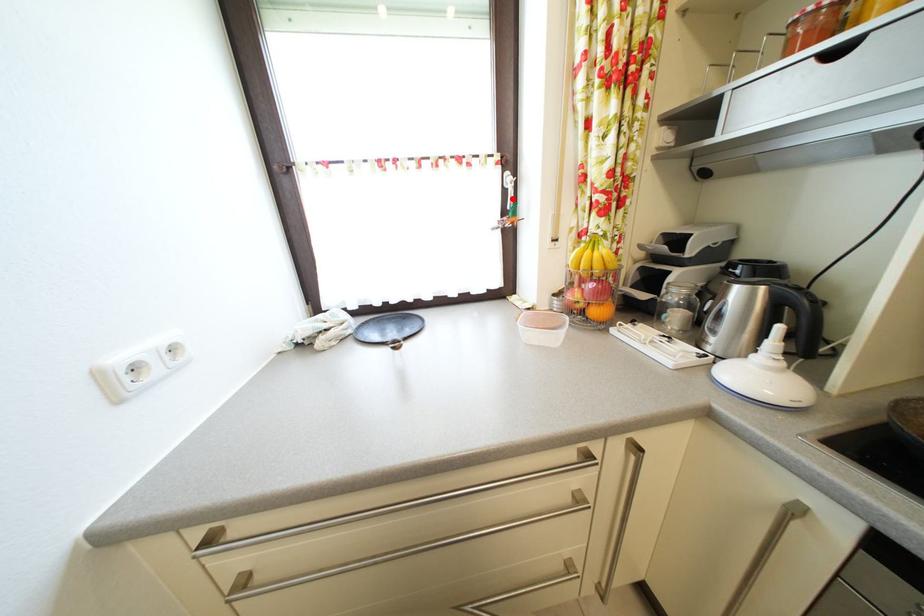
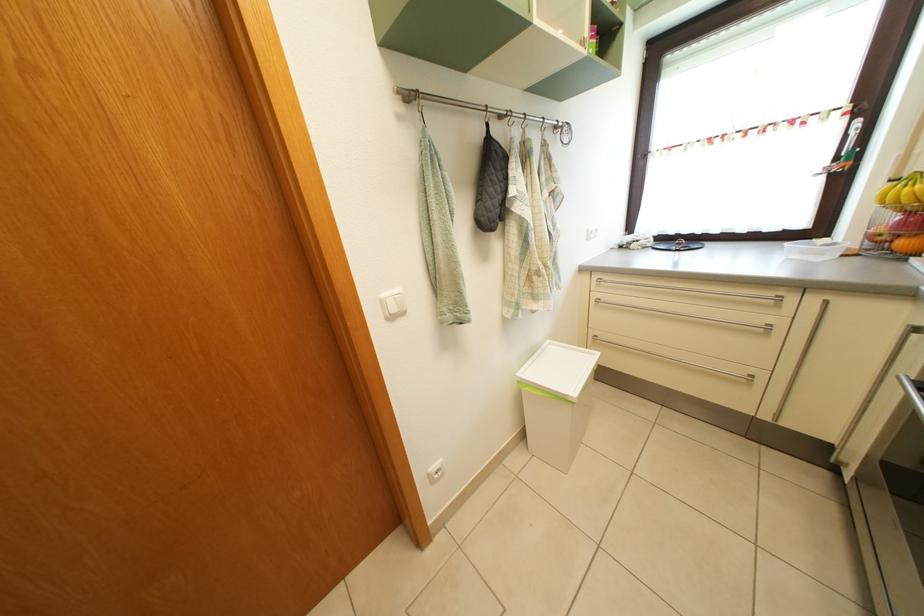
Where in the second image is the point corresponding to the highlighted location from the first image?

(853, 146)